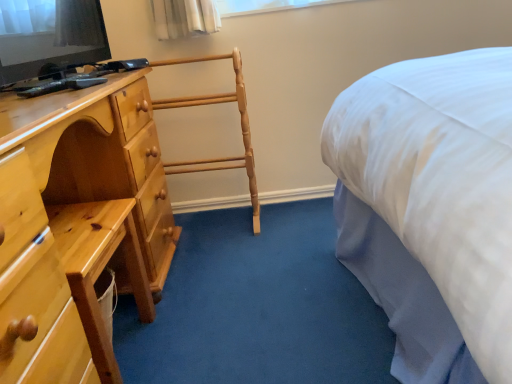
Question: Does white glass window at upper center contain light brown wooden chest of drawers at left?

Choices:
 (A) yes
 (B) no

Answer: (B)

Question: Is white glass window at upper center to the left of light brown wooden chest of drawers at left from the viewer's perspective?

Choices:
 (A) no
 (B) yes

Answer: (A)

Question: From a real-world perspective, is white glass window at upper center under light brown wooden chest of drawers at left?

Choices:
 (A) yes
 (B) no

Answer: (B)

Question: Considering the relative sizes of white glass window at upper center and light brown wooden chest of drawers at left in the image provided, is white glass window at upper center shorter than light brown wooden chest of drawers at left?

Choices:
 (A) no
 (B) yes

Answer: (B)

Question: Is white glass window at upper center directly adjacent to light brown wooden chest of drawers at left?

Choices:
 (A) no
 (B) yes

Answer: (A)

Question: Is point (219, 3) positioned closer to the camera than point (119, 233)?

Choices:
 (A) closer
 (B) farther

Answer: (B)

Question: Considering their positions, is white glass window at upper center located in front of or behind light brown wooden chest of drawers at left?

Choices:
 (A) front
 (B) behind

Answer: (B)

Question: Considering the relative positions of white glass window at upper center and light brown wooden chest of drawers at left in the image provided, is white glass window at upper center to the left or to the right of light brown wooden chest of drawers at left?

Choices:
 (A) right
 (B) left

Answer: (A)

Question: Considering the positions of white glass window at upper center and light brown wooden chest of drawers at left in the image, is white glass window at upper center bigger or smaller than light brown wooden chest of drawers at left?

Choices:
 (A) big
 (B) small

Answer: (B)

Question: From the image's perspective, is matte black television at upper left positioned above or below white glass window at upper center?

Choices:
 (A) above
 (B) below

Answer: (B)

Question: Considering their positions, is matte black television at upper left located in front of or behind white glass window at upper center?

Choices:
 (A) behind
 (B) front

Answer: (B)

Question: Based on their sizes in the image, would you say matte black television at upper left is bigger or smaller than white glass window at upper center?

Choices:
 (A) small
 (B) big

Answer: (B)

Question: In terms of height, does matte black television at upper left look taller or shorter compared to white glass window at upper center?

Choices:
 (A) tall
 (B) short

Answer: (A)

Question: Does point (49, 292) appear closer or farther from the camera than point (247, 8)?

Choices:
 (A) closer
 (B) farther

Answer: (A)

Question: Considering their positions, is light brown wooden chest of drawers at left located in front of or behind white glass window at upper center?

Choices:
 (A) front
 (B) behind

Answer: (A)